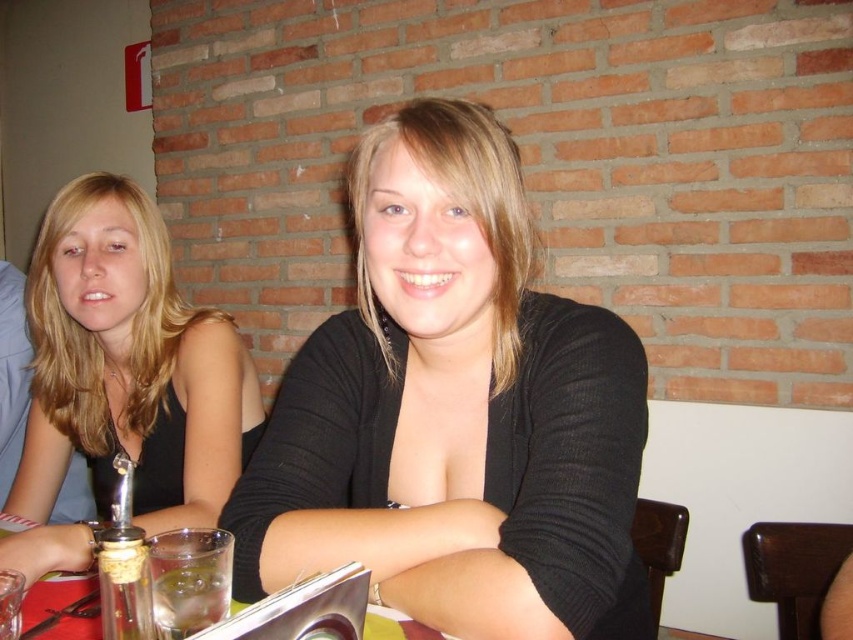
You are a photographer setting up for a photoshoot. You need to ensure that the matte black tank top at left and the clear glass at lower center are visible in the frame. Given their sizes, which object should you focus on first to ensure proper framing?

The matte black tank top at left is larger in size than the clear glass at lower center, so you should focus on the matte black tank top at left first to ensure it fits well within the frame before adjusting for the smaller clear glass at lower center.

You are a photographer trying to capture a closeup of the black matte sweater at center. The camera you are using has a focal length of 50mm. To ensure the point at coordinates point (454, 412) is in focus, where should you position the camera relative to the table?

The point at coordinates point (454, 412) is on the black matte sweater at center, so you should position the camera directly facing the black matte sweater at center to ensure the point is in focus.

In the scene shown: You are a server at a restaurant and need to place a new drink order on the table between the black matte sweater at center and the clear glass at lower center. Where should you place the drink to ensure it is between these two items?

The black matte sweater at center is located above the clear glass at lower center, so you should place the drink between them by positioning it below the sweater but above the clear glass at lower center.